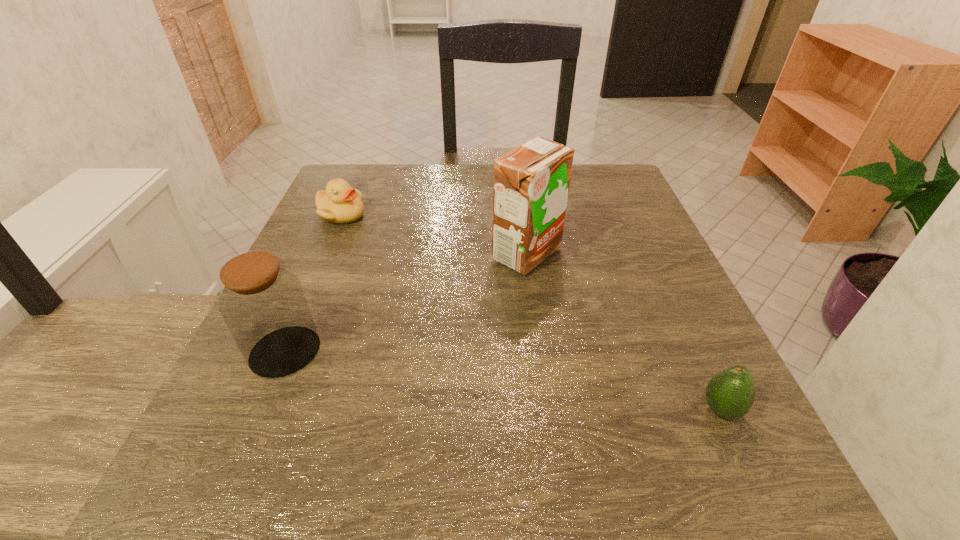
You are a GUI agent. You are given a task and a screenshot of the screen. Output one action in this format:
    pyautogui.click(x=<x>, y=<y>)
    Task: Click on the empty location between the duckling and the avocado
    
    Given the screenshot: What is the action you would take?
    pyautogui.click(x=531, y=312)

The image size is (960, 540). What are the coordinates of `free space between the farthest object and the tallest object` in the screenshot? It's located at (434, 234).

Identify the location of vacant area that lies between the jar and the nearest object. (503, 381).

Find the location of `blank region between the nearest object and the second object from right to left`. blank region between the nearest object and the second object from right to left is located at coordinates pos(624,332).

Where is `vacant region between the second farthest object and the avocado`? The image size is (960, 540). vacant region between the second farthest object and the avocado is located at coordinates (624, 332).

Point out which object is positioned as the second nearest to the jar. Please provide its 2D coordinates. Your answer should be formatted as a tuple, i.e. [(x, y)], where the tuple contains the x and y coordinates of a point satisfying the conditions above.

[(531, 183)]

Identify which object is the nearest to the second nearest object. Please provide its 2D coordinates. Your answer should be formatted as a tuple, i.e. [(x, y)], where the tuple contains the x and y coordinates of a point satisfying the conditions above.

[(340, 203)]

What are the coordinates of `vacant position in the image that satisfies the following two spatial constraints: 1. on the back side of the avocado; 2. on the straw side of the tallest object` in the screenshot? It's located at (648, 254).

The height and width of the screenshot is (540, 960). What are the coordinates of `vacant area that satisfies the following two spatial constraints: 1. on the back side of the rightmost object; 2. on the beak of the farthest object` in the screenshot? It's located at (630, 215).

Find the location of a particular element. Image resolution: width=960 pixels, height=540 pixels. vacant area that satisfies the following two spatial constraints: 1. on the front side of the third shortest object; 2. on the right side of the avocado is located at coordinates pos(260,409).